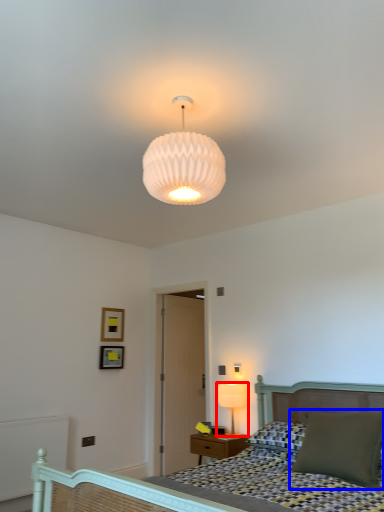
Question: Which of the following is the farthest to the observer, lamp (highlighted by a red box) or pillow (highlighted by a blue box)?

Choices:
 (A) lamp
 (B) pillow

Answer: (A)